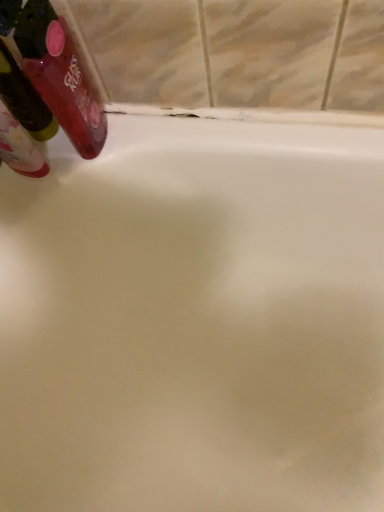
Locate an element on the screen. The width and height of the screenshot is (384, 512). vacant space to the right of translucent plastic mouthwash at upper left, acting as the second mouthwash starting from the left is located at coordinates (181, 131).